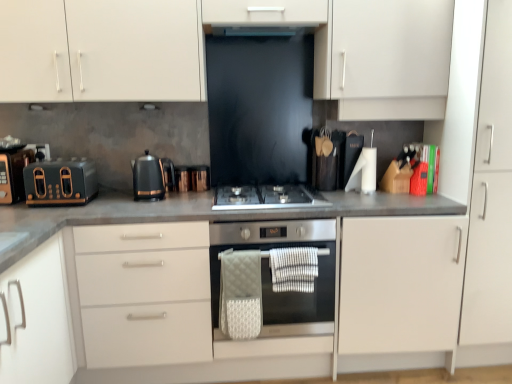
Where is `free space in front of metallic copper kettle at center, which is counted as the third appliance, starting from the left`? Image resolution: width=512 pixels, height=384 pixels. free space in front of metallic copper kettle at center, which is counted as the third appliance, starting from the left is located at coordinates [x=193, y=199].